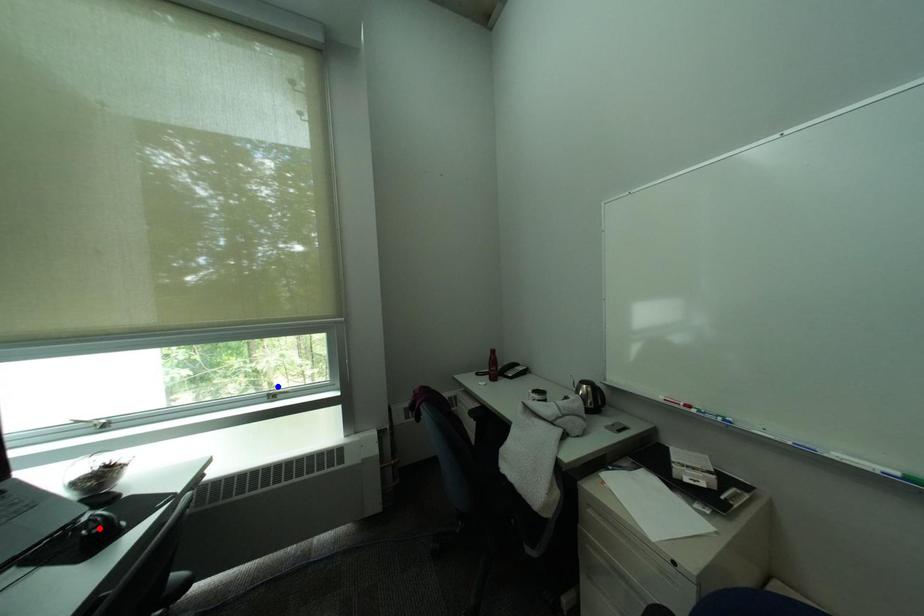
Question: In the image, two points are highlighted. Which point is nearer to the camera? Reply with the corresponding letter.

Choices:
 (A) blue point
 (B) red point

Answer: (B)